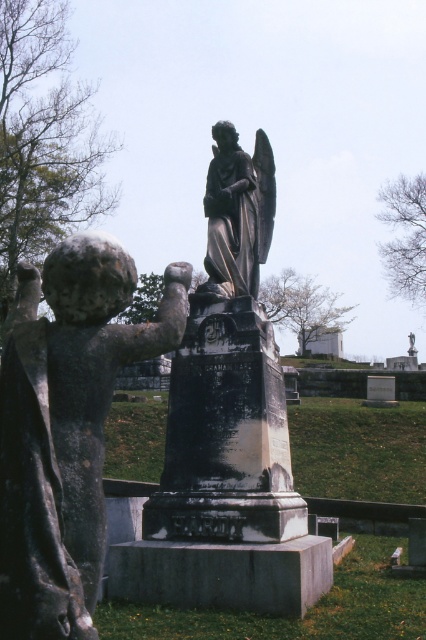
Question: Which object appears closest to the camera in this image?

Choices:
 (A) matte stone cherub at left
 (B) black marble statue at center
 (C) polished bronze angel at center

Answer: (A)

Question: Can you confirm if matte stone cherub at left is bigger than black marble statue at center?

Choices:
 (A) yes
 (B) no

Answer: (B)

Question: Observing the image, what is the correct spatial positioning of matte stone cherub at left in reference to black marble statue at center?

Choices:
 (A) above
 (B) below

Answer: (B)

Question: Is black marble statue at center positioned in front of polished bronze angel at center?

Choices:
 (A) yes
 (B) no

Answer: (A)

Question: Considering the real-world distances, which object is farthest from the matte stone cherub at left?

Choices:
 (A) black marble statue at center
 (B) polished bronze angel at center

Answer: (B)

Question: Which of these objects is positioned closest to the matte stone cherub at left?

Choices:
 (A) black marble statue at center
 (B) polished bronze angel at center

Answer: (A)